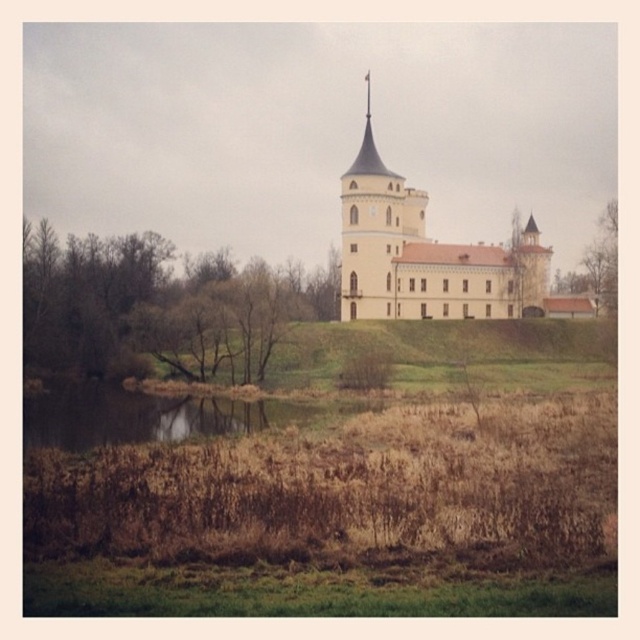
Question: Can you confirm if brown grassy water at lower left is wider than brown textured tree at right?

Choices:
 (A) no
 (B) yes

Answer: (B)

Question: Which point is closer to the camera taking this photo?

Choices:
 (A) (424, 294)
 (B) (557, 269)

Answer: (A)

Question: Is brown grassy water at lower left bigger than brown textured tree at right?

Choices:
 (A) yes
 (B) no

Answer: (B)

Question: Which point is farther from the camera taking this photo?

Choices:
 (A) (125, 394)
 (B) (524, 298)
 (C) (589, 259)

Answer: (C)

Question: Which of these objects is positioned closest to the brown grassy water at lower left?

Choices:
 (A) white smooth castle at center
 (B) brown leafy tree at left

Answer: (B)

Question: Is brown grassy water at lower left to the right of brown textured tree at right from the viewer's perspective?

Choices:
 (A) yes
 (B) no

Answer: (B)